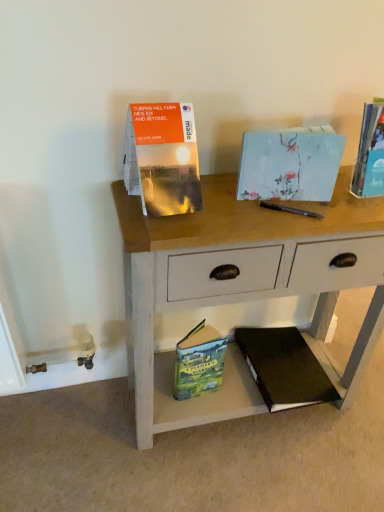
Question: Does light blue paper at center, the second paperback book from the top, appear on the right side of green matte paperback book at lower center, positioned as the fourth paperback book in top-to-bottom order?

Choices:
 (A) no
 (B) yes

Answer: (B)

Question: Does light blue paper at center, the 4th paperback book from the bottom, have a lesser height compared to green matte paperback book at lower center, positioned as the fourth paperback book in top-to-bottom order?

Choices:
 (A) no
 (B) yes

Answer: (B)

Question: From a real-world perspective, is light blue paper at center, the 4th paperback book from the bottom, under green matte paperback book at lower center, positioned as the fourth paperback book in top-to-bottom order?

Choices:
 (A) no
 (B) yes

Answer: (A)

Question: From the image's perspective, is light blue paper at center, the second paperback book from the top, on top of green matte paperback book at lower center, positioned as the fourth paperback book in top-to-bottom order?

Choices:
 (A) yes
 (B) no

Answer: (A)

Question: Considering the relative sizes of light blue paper at center, the 4th paperback book from the bottom, and green matte paperback book at lower center, positioned as the fourth paperback book in top-to-bottom order, in the image provided, is light blue paper at center, the 4th paperback book from the bottom, thinner than green matte paperback book at lower center, positioned as the fourth paperback book in top-to-bottom order,?

Choices:
 (A) no
 (B) yes

Answer: (A)

Question: Considering the relative sizes of light blue paper at center, the second paperback book from the top, and green matte paperback book at lower center, positioned as the fourth paperback book in top-to-bottom order, in the image provided, is light blue paper at center, the second paperback book from the top, smaller than green matte paperback book at lower center, positioned as the fourth paperback book in top-to-bottom order,?

Choices:
 (A) no
 (B) yes

Answer: (A)

Question: Would you say wooden desk at center is outside black hardcover book at lower right, the fifth paperback book viewed from the top?

Choices:
 (A) yes
 (B) no

Answer: (A)

Question: Is wooden desk at center aimed at black hardcover book at lower right, arranged as the 1th paperback book when ordered from the bottom?

Choices:
 (A) no
 (B) yes

Answer: (B)

Question: Considering the relative sizes of wooden desk at center and black hardcover book at lower right, arranged as the 1th paperback book when ordered from the bottom, in the image provided, is wooden desk at center thinner than black hardcover book at lower right, arranged as the 1th paperback book when ordered from the bottom,?

Choices:
 (A) yes
 (B) no

Answer: (A)

Question: Is wooden desk at center touching black hardcover book at lower right, arranged as the 1th paperback book when ordered from the bottom?

Choices:
 (A) no
 (B) yes

Answer: (A)

Question: Considering the relative sizes of wooden desk at center and black hardcover book at lower right, the fifth paperback book viewed from the top, in the image provided, is wooden desk at center taller than black hardcover book at lower right, the fifth paperback book viewed from the top,?

Choices:
 (A) no
 (B) yes

Answer: (B)

Question: Is wooden desk at center behind black hardcover book at lower right, arranged as the 1th paperback book when ordered from the bottom?

Choices:
 (A) no
 (B) yes

Answer: (A)

Question: From the image's perspective, is light blue paper at center, the 4th paperback book from the bottom, above matte orange map at upper left, the third paperback book positioned from the bottom?

Choices:
 (A) no
 (B) yes

Answer: (B)